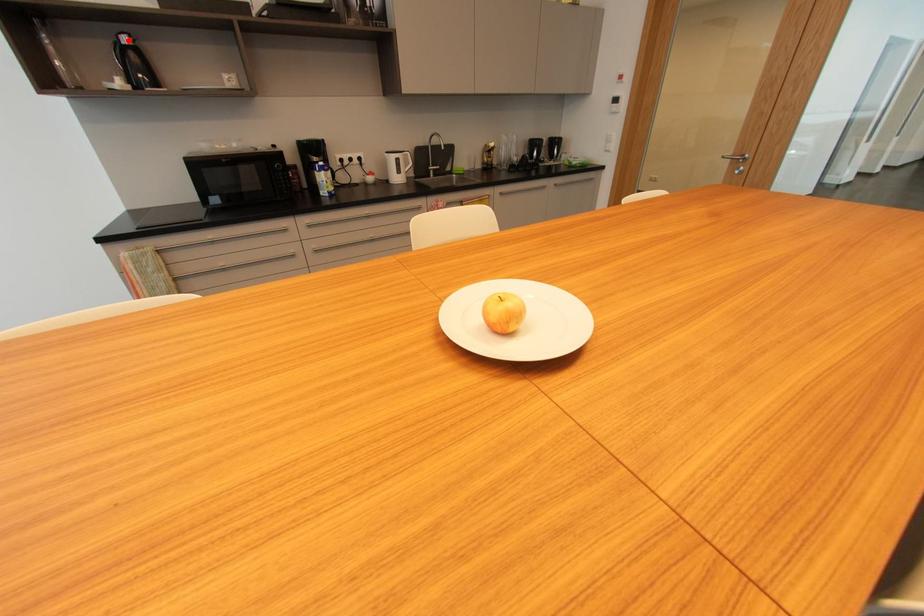
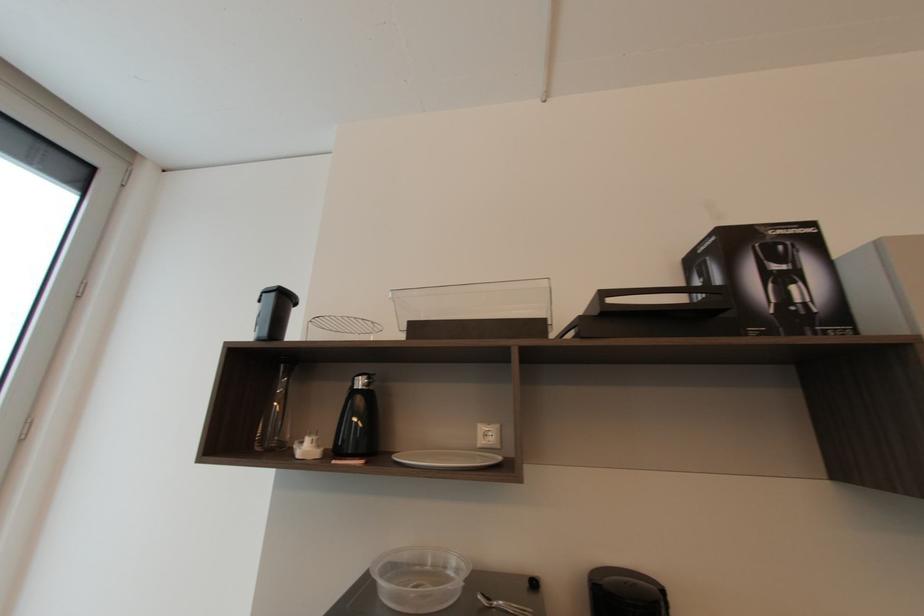
Locate, in the second image, the point that corresponds to the highlighted location in the first image.

(362, 384)